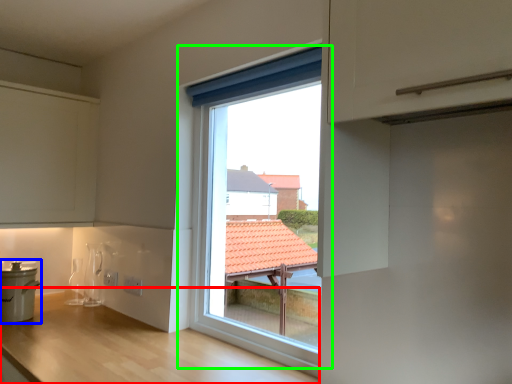
Question: Which object is positioned closest to counter (highlighted by a red box)? Select from cooker (highlighted by a blue box) and window (highlighted by a green box).

Choices:
 (A) cooker
 (B) window

Answer: (A)